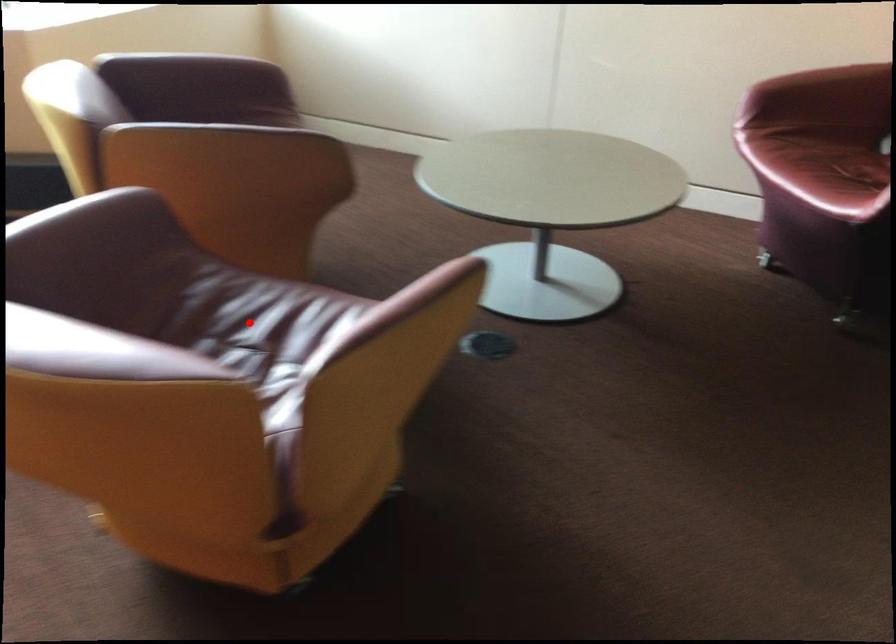
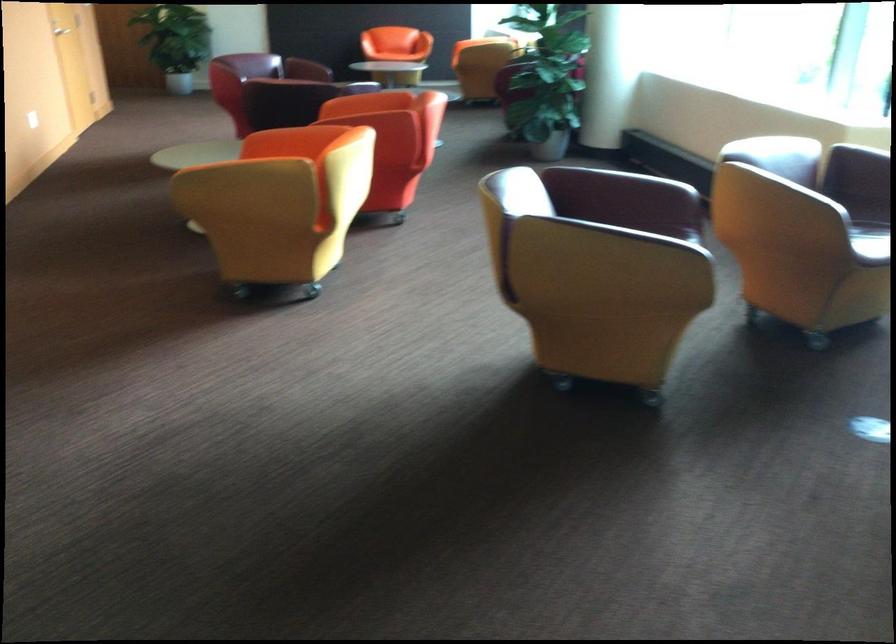
Question: I am providing you with two images of the same scene from different viewpoints. A red point is marked on the first image. Is the red point's position out of view in image 2?

Choices:
 (A) Yes
 (B) No

Answer: (A)